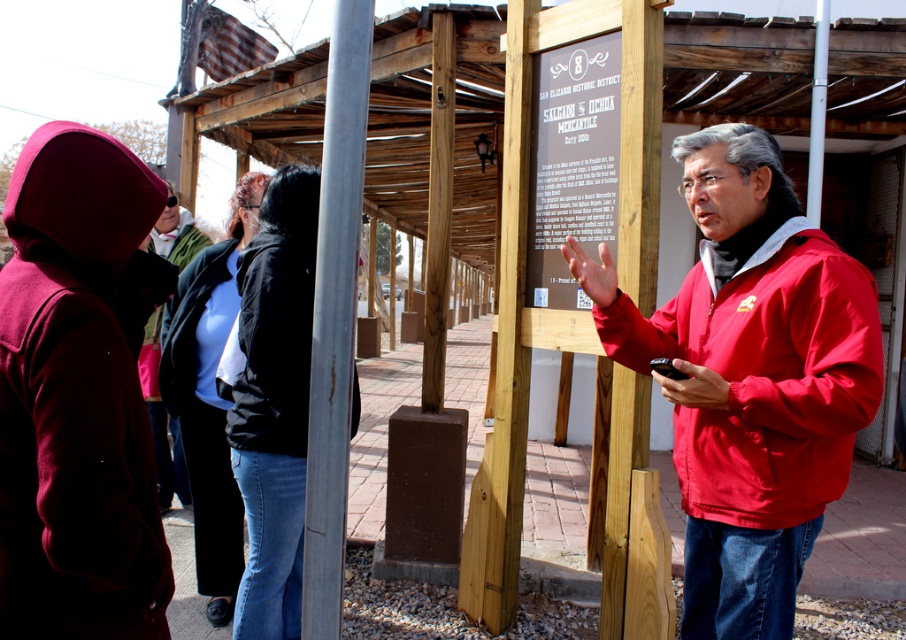
Question: Can you confirm if red matte jacket at right is wider than silver metallic pole at center?

Choices:
 (A) yes
 (B) no

Answer: (A)

Question: Estimate the real-world distances between objects in this image. Which object is closer to the maroon woolen jacket at left?

Choices:
 (A) red matte jacket at right
 (B) white plastic pole at upper right
 (C) matte black jacket at center

Answer: (A)

Question: Does red matte jacket at right have a smaller size compared to silver metallic pole at center?

Choices:
 (A) no
 (B) yes

Answer: (A)

Question: Does maroon woolen jacket at left appear over white plastic pole at upper right?

Choices:
 (A) no
 (B) yes

Answer: (A)

Question: Which point is farther to the camera?

Choices:
 (A) matte black jacket at center
 (B) silver metallic pole at center
 (C) maroon woolen jacket at left
 (D) dark blue jacket at center

Answer: (D)

Question: Which object is closer to the camera taking this photo?

Choices:
 (A) white plastic pole at upper right
 (B) matte black jacket at center

Answer: (B)